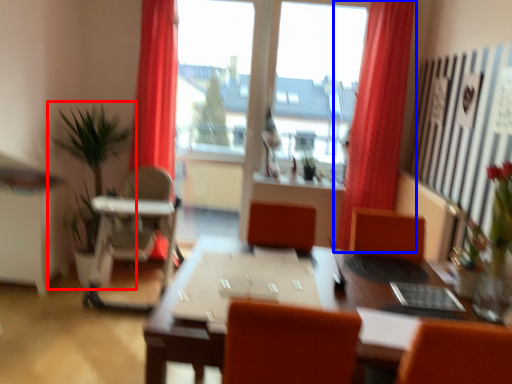
Question: Which of the following is the farthest to the observer, houseplant (highlighted by a red box) or curtain (highlighted by a blue box)?

Choices:
 (A) houseplant
 (B) curtain

Answer: (B)